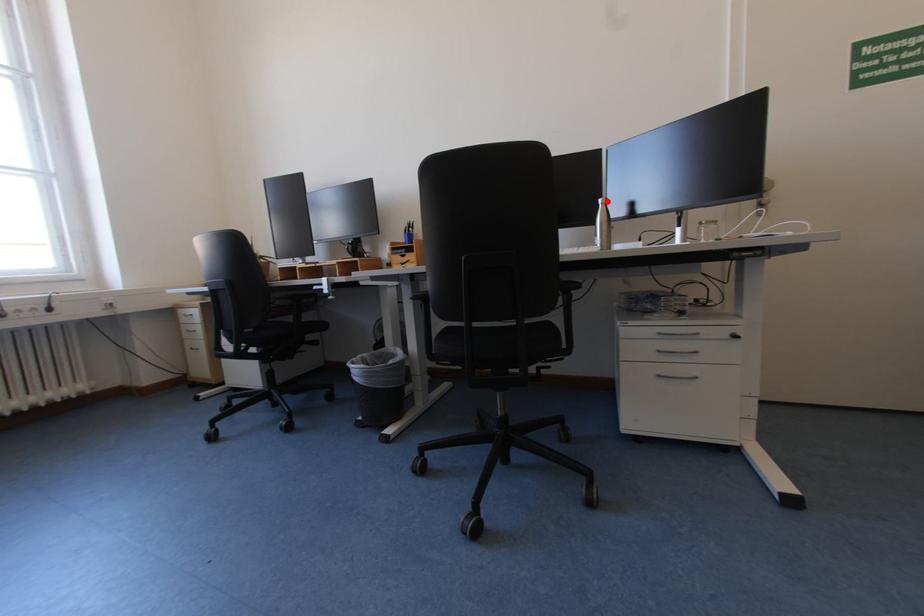
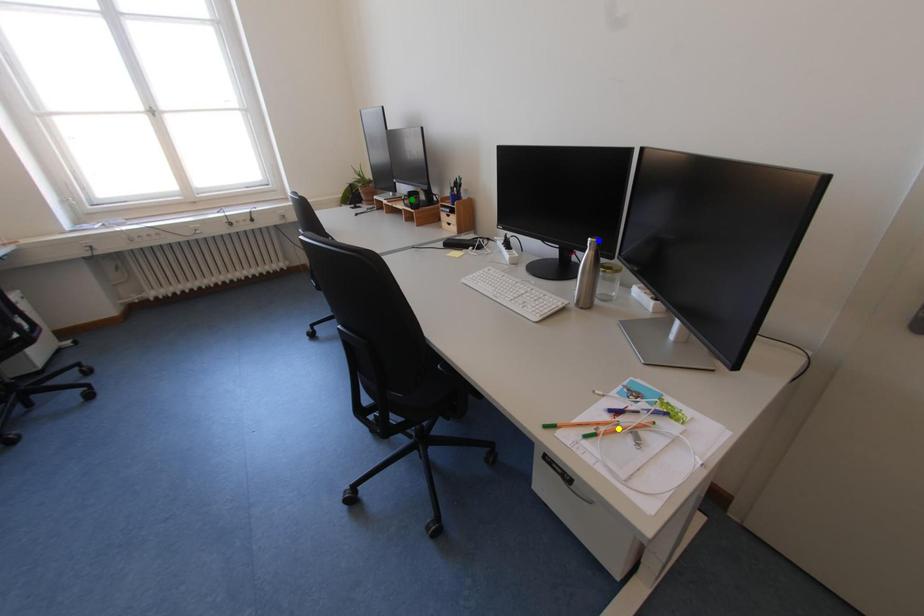
Question: I am providing you with two images of the same scene from different viewpoints. A red point is marked on the first image. You are given multiple points on the second image. Which mark in image 2 goes with the point in image 1?

Choices:
 (A) blue point
 (B) green point
 (C) yellow point

Answer: (A)